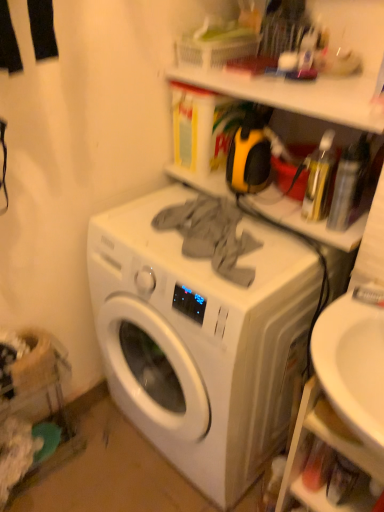
Question: Is matte plastic shelf at upper center, which is counted as the second shelf, starting from the bottom, bigger or smaller than white matte washing machine at center?

Choices:
 (A) small
 (B) big

Answer: (A)

Question: Looking at their shapes, would you say matte plastic shelf at upper center, which is counted as the second shelf, starting from the bottom, is wider or thinner than white matte washing machine at center?

Choices:
 (A) thin
 (B) wide

Answer: (A)

Question: Which object is positioned closest to the white matte washing machine at center?

Choices:
 (A) matte plastic shelf at upper center, the 2th shelf positioned from the top
 (B) white plastic shelf at upper center, arranged as the 1th shelf when viewed from the top
 (C) white plastic shelf at lower right, arranged as the 1th shelf when ordered from the bottom

Answer: (C)

Question: Which is nearer to the white plastic shelf at lower right, the 3th shelf viewed from the top?

Choices:
 (A) white matte washing machine at center
 (B) matte plastic shelf at upper center, the 2th shelf positioned from the top
 (C) white plastic shelf at upper center, the third shelf from the bottom

Answer: (A)